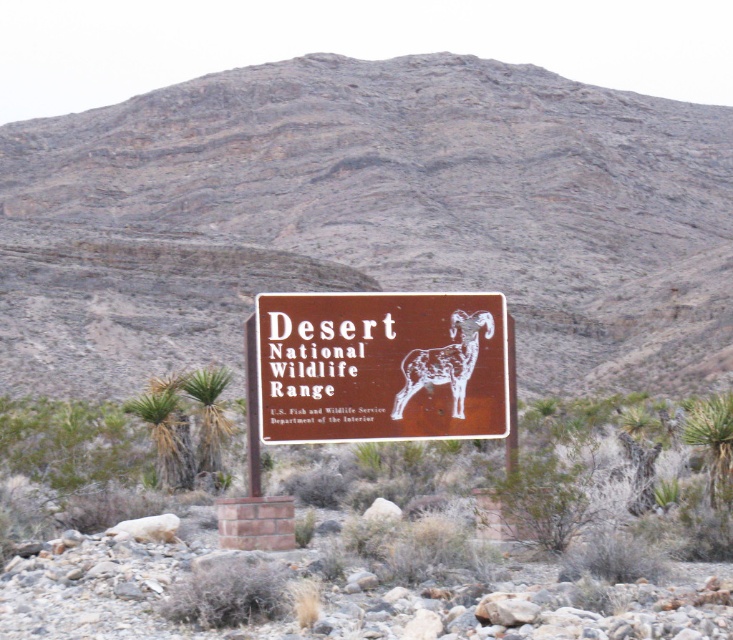
Question: Among these objects, which one is nearest to the camera?

Choices:
 (A) brown matte sign at center
 (B) white textured ram at center

Answer: (A)

Question: Which point appears farthest from the camera in this image?

Choices:
 (A) (485, 330)
 (B) (342, 316)

Answer: (A)

Question: Is brown matte sign at center wider than white textured ram at center?

Choices:
 (A) yes
 (B) no

Answer: (A)

Question: Can you confirm if brown matte sign at center is positioned below white textured ram at center?

Choices:
 (A) no
 (B) yes

Answer: (A)

Question: Among these points, which one is farthest from the camera?

Choices:
 (A) (405, 397)
 (B) (479, 364)

Answer: (B)

Question: In this image, where is brown matte sign at center located relative to white textured ram at center?

Choices:
 (A) right
 (B) left

Answer: (B)